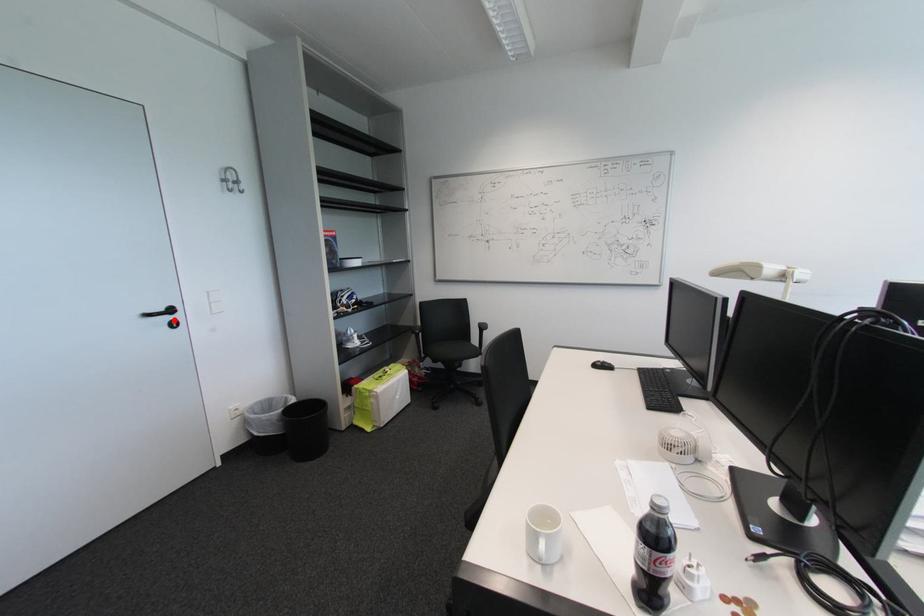
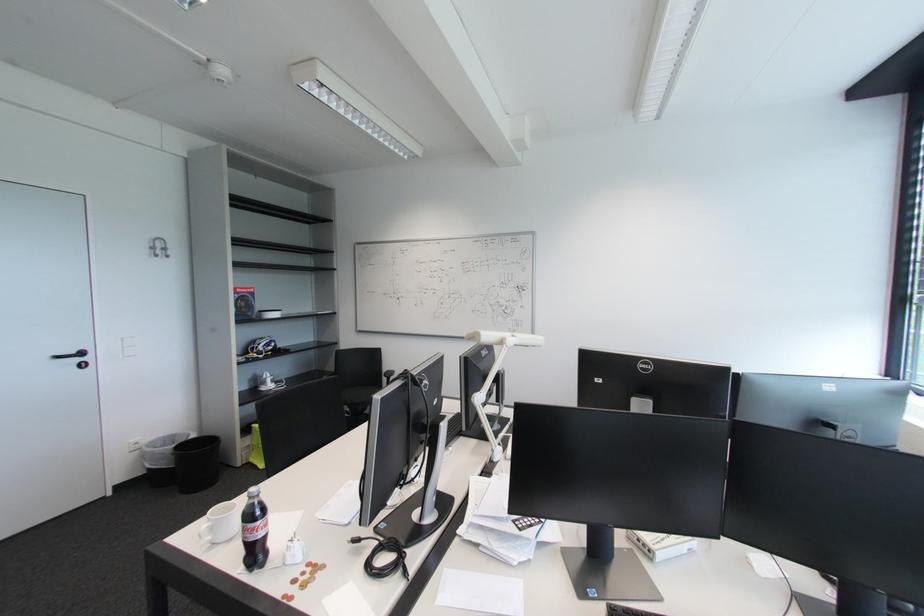
Find the pixel in the second image that matches the highlighted location in the first image.

(83, 361)